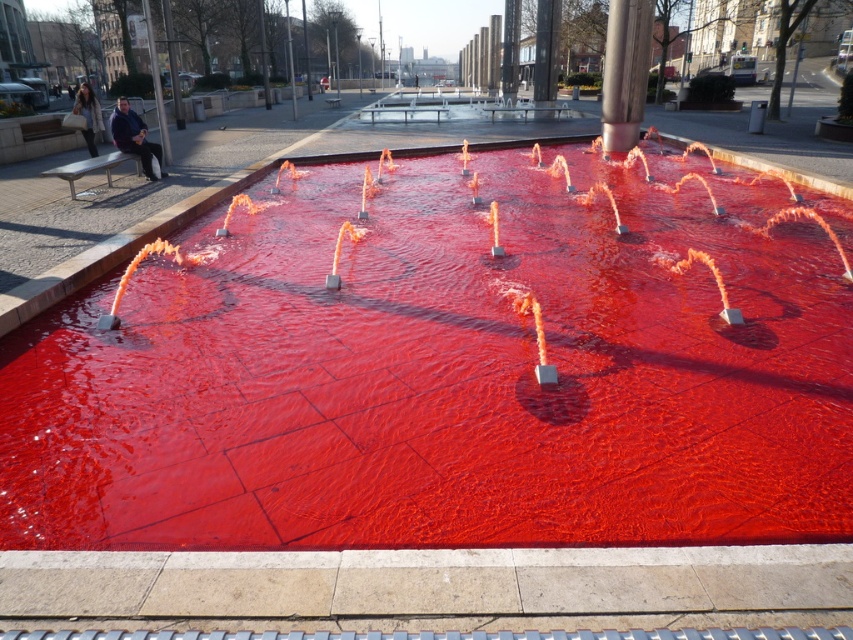
You are standing at the edge of the red fountain and want to take a photo of both the red glossy water at center and the polished stainless steel pole at center. Which object should you position to the right side in your camera frame?

You should position the polished stainless steel pole at center to the right side in your camera frame because the red glossy water at center is positioned on the left side of it.

You are a maintenance worker tasked with ensuring safety around the fountain. You need to determine if the red glossy water at center could potentially overflow and reach the polished stainless steel pole at center. Based on their widths, can the water overflow to the pole?

The red glossy water at center is wider than the polished stainless steel pole at center, so the water could potentially overflow and reach the pole.

You are standing in the public square and want to take a photo of the red glossy water at center and the polished stainless steel pole at center. Which object should you focus on first if you want to capture both in a single frame without moving the camera?

The red glossy water at center has a smaller size compared to polished stainless steel pole at center, so you should focus on the red glossy water at center first to ensure it is in clear view before adjusting the camera settings for the larger pole.